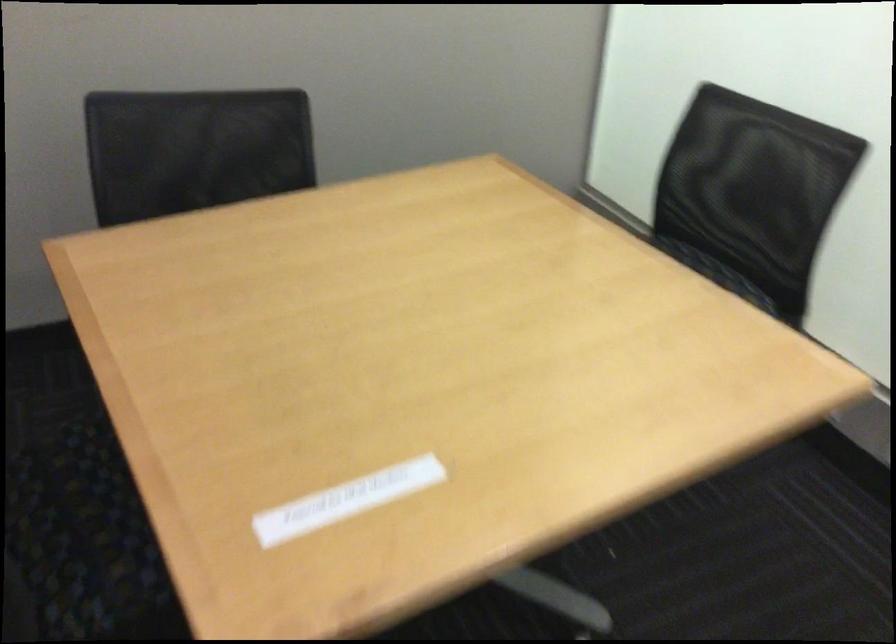
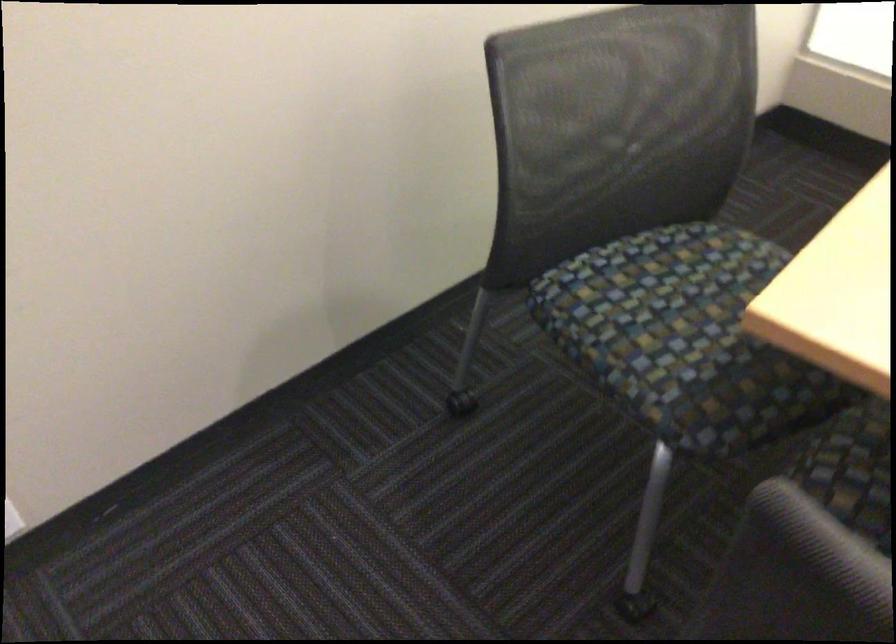
What movement of the cameraman would produce the second image?

The movement direction of the cameraman is left, forward.